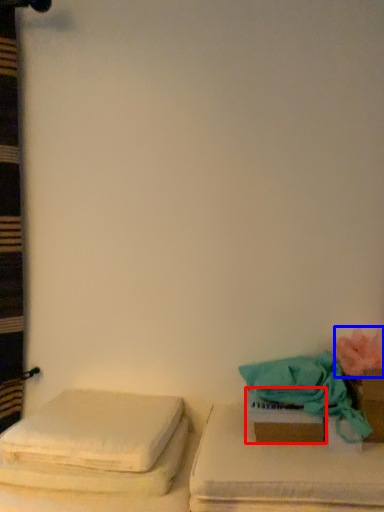
Question: Among these objects, which one is farthest to the camera, box (highlighted by a red box) or flower (highlighted by a blue box)?

Choices:
 (A) box
 (B) flower

Answer: (A)